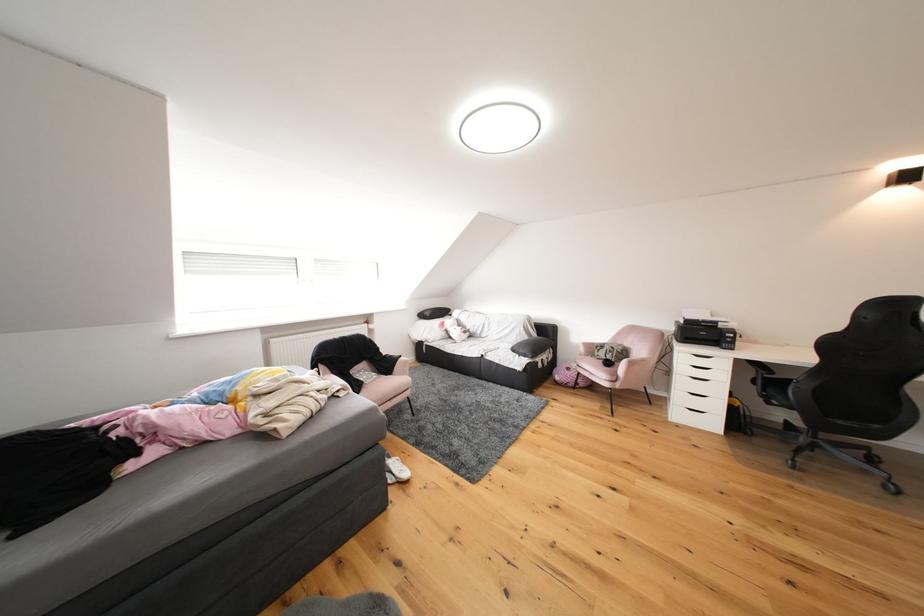
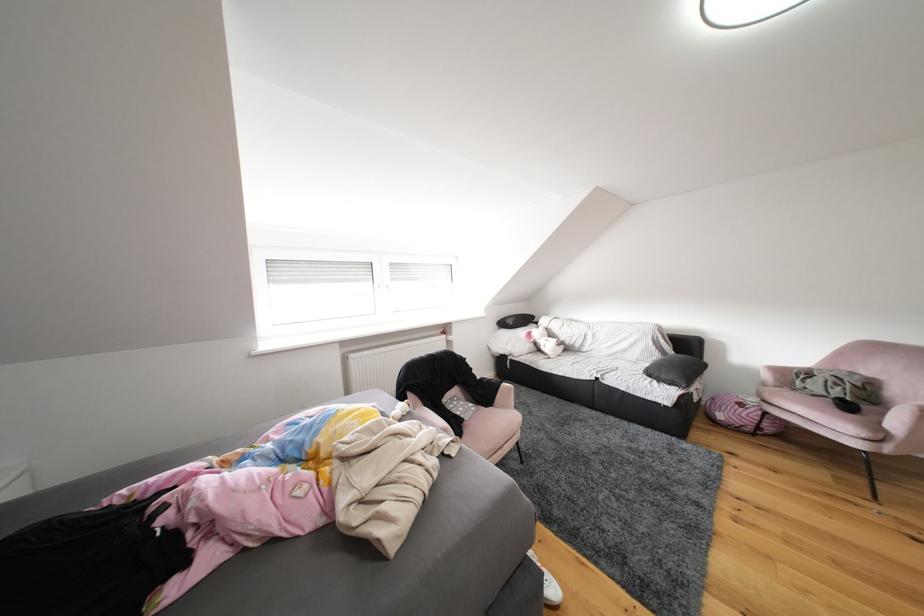
The images are taken continuously from a first-person perspective. In which direction are you moving?

The cameraman moved toward left, forward.